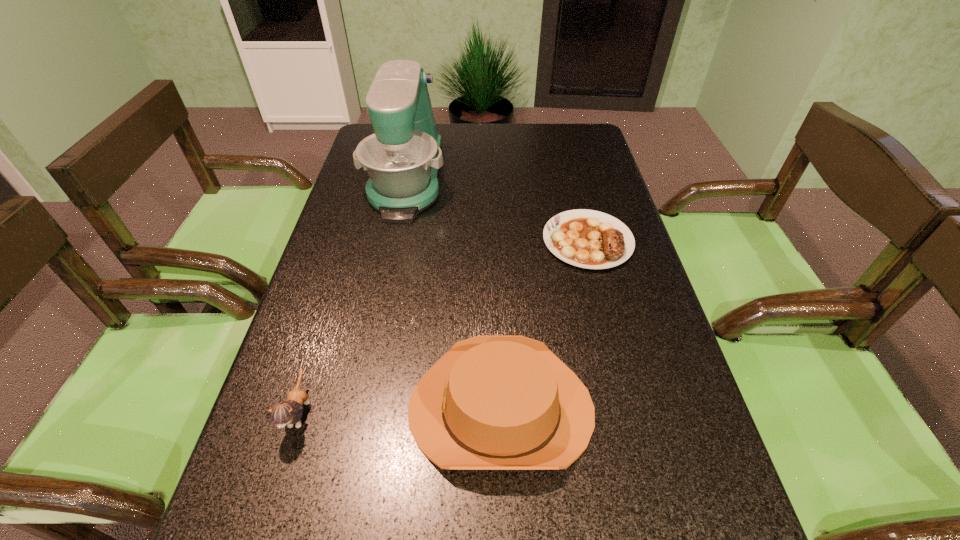
This screenshot has width=960, height=540. I want to click on object that is positioned at the far edge, so click(402, 157).

Locate an element on the screen. mixer present at the left edge is located at coordinates (402, 157).

Identify the location of kitten that is at the left edge. (289, 412).

The height and width of the screenshot is (540, 960). I want to click on object that is positioned at the right edge, so click(590, 239).

The height and width of the screenshot is (540, 960). What are the coordinates of `object that is at the far left corner` in the screenshot? It's located at (402, 157).

Where is `free location at the far edge of the desktop`? The height and width of the screenshot is (540, 960). free location at the far edge of the desktop is located at coordinates (491, 147).

Image resolution: width=960 pixels, height=540 pixels. In order to click on vacant space at the left edge of the desktop in this screenshot , I will do `click(236, 501)`.

I want to click on free spot at the right edge of the desktop, so [x=602, y=282].

This screenshot has width=960, height=540. What are the coordinates of `free space at the far right corner of the desktop` in the screenshot? It's located at (567, 147).

At what (x,y) coordinates should I click in order to perform the action: click on blank region between the tallest object and the kitten. Please return your answer as a coordinate pair (x, y). The image size is (960, 540). Looking at the image, I should click on (353, 295).